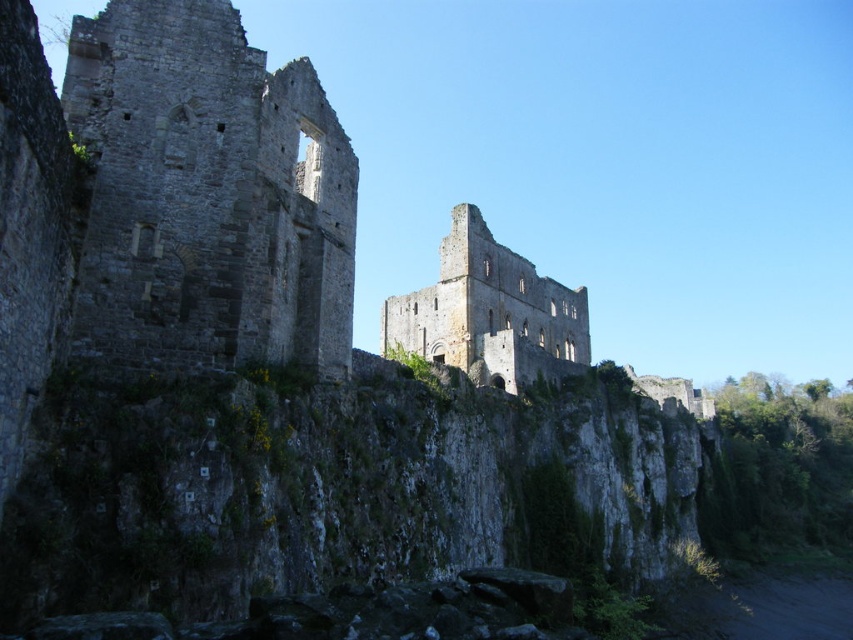
Question: Is gray stone ruins at center behind rustic stone ruins at center?

Choices:
 (A) yes
 (B) no

Answer: (B)

Question: Among these objects, which one is nearest to the camera?

Choices:
 (A) rustic stone ruins at center
 (B) gray stone ruins at center

Answer: (B)

Question: Can you confirm if gray stone ruins at center is bigger than rustic stone ruins at center?

Choices:
 (A) yes
 (B) no

Answer: (B)

Question: Which point is farther to the camera?

Choices:
 (A) rustic stone ruins at center
 (B) gray stone ruins at center

Answer: (A)

Question: Is gray stone ruins at center positioned at the back of rustic stone ruins at center?

Choices:
 (A) yes
 (B) no

Answer: (B)